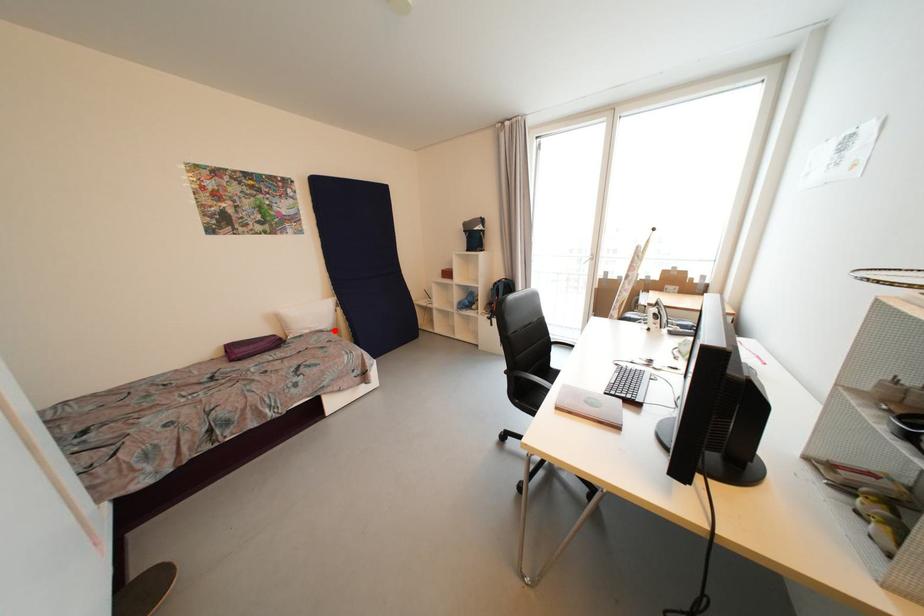
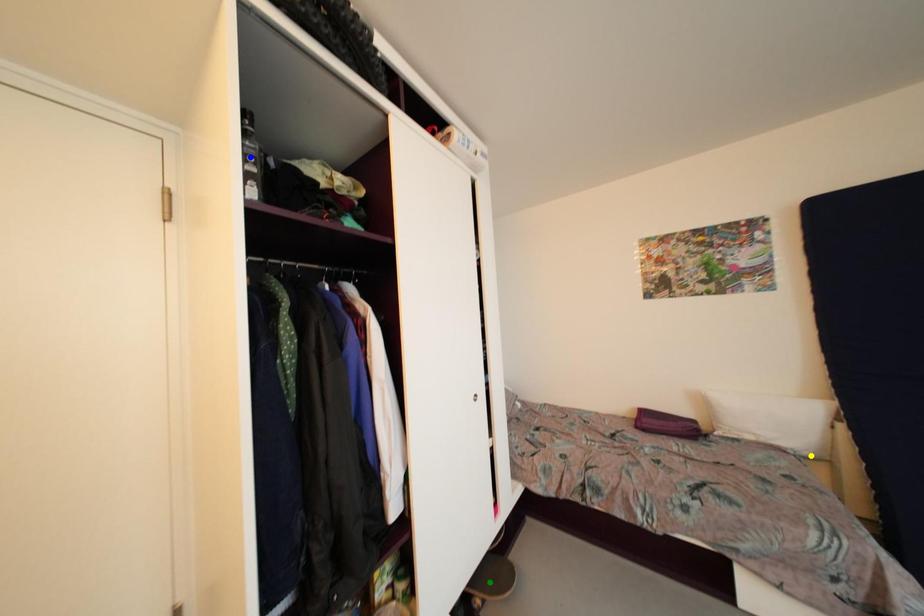
Question: I am providing you with two images of the same scene from different viewpoints. A red point is marked on the first image. You are given multiple points on the second image. Which point in image 2 is actually the same real-world point as the red point in image 1?

Choices:
 (A) blue point
 (B) yellow point
 (C) green point

Answer: (B)